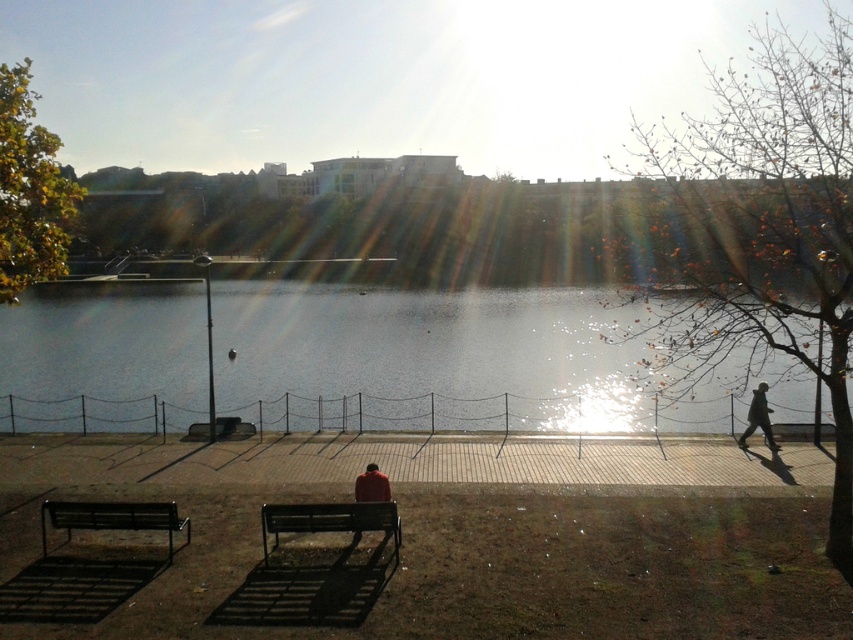
You are planning to place a new bench on the riverside walkway. The existing metallic black bench at lower left is smaller than the dark gray jacket at right. Considering the size difference, which bench should you choose to ensure it accommodates more people comfortably?

The dark gray jacket at right is larger than the metallic black bench at lower left, so choosing the dark gray jacket at right would accommodate more people comfortably.

You are standing on the paved walkway and want to sit down next to the person wearing the dark gray jacket at right. Which bench should you choose between the metallic black bench at lower left and the other bench not mentioned?

You should choose the metallic black bench at lower left because it is positioned to the left of the dark gray jacket at right, placing it closer to the person.

You are standing at the point marked as point (x=329, y=518). What object is located exactly at this point?

The metallic dark bench at center is located exactly at point (x=329, y=518).